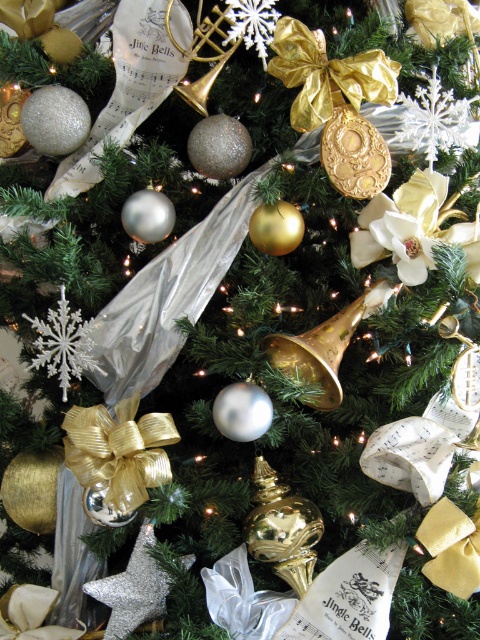
You are standing in front of the Christmas tree and notice two gold shiny ribbons. One is labeled as gold shiny ribbon at center and the other as gold shiny ribbon at upper center. Which ribbon is positioned to the left when looking at the tree?

The gold shiny ribbon at center is to the left of the gold shiny ribbon at upper center.

You are standing 3 feet away from the Christmas tree. You want to reach the gold shiny ribbon at upper center to adjust its position. Can you reach it without moving closer?

The gold shiny ribbon at upper center is 30.37 inches away from the camera. Since you are standing 3 feet away, which is 36 inches, you are 5.63 inches farther than the ribbon. Therefore, you can reach it without moving closer.